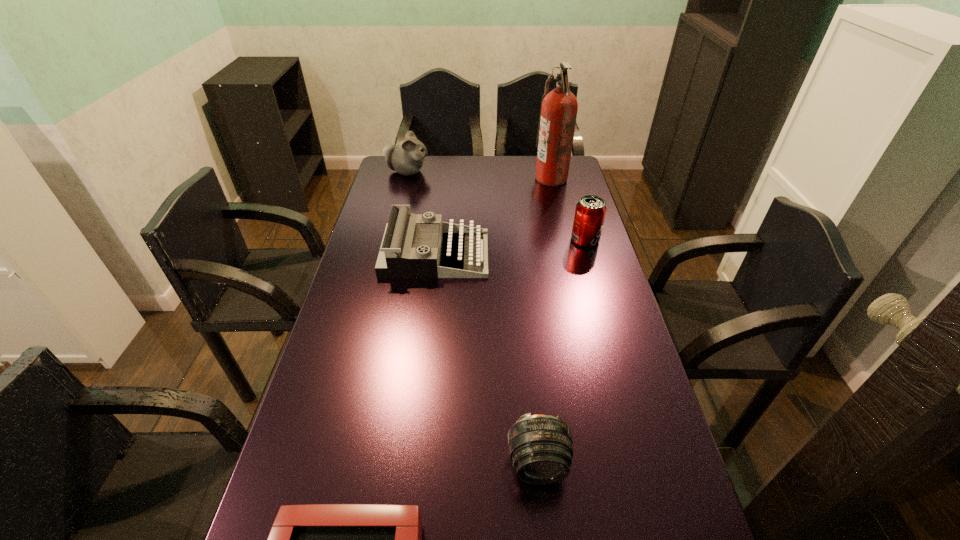
Choose which object is the nearest neighbor to the tallest object. Please provide its 2D coordinates. Your answer should be formatted as a tuple, i.e. [(x, y)], where the tuple contains the x and y coordinates of a point satisfying the conditions above.

[(590, 211)]

You are a GUI agent. You are given a task and a screenshot of the screen. Output one action in this format:
    pyautogui.click(x=<x>, y=<y>)
    Task: Click on the blank space that satisfies the following two spatial constraints: 1. on the back side of the soda can; 2. on the front of the fire extinguisher near the operation label
    The height and width of the screenshot is (540, 960).
    Given the screenshot: What is the action you would take?
    pyautogui.click(x=567, y=178)

The width and height of the screenshot is (960, 540). In order to click on free space that satisfies the following two spatial constraints: 1. on the front of the fire extinguisher near the operation label; 2. on the back side of the soda can in this screenshot , I will do `click(565, 240)`.

Locate an element on the screen. This screenshot has width=960, height=540. free space that satisfies the following two spatial constraints: 1. on the face of the soda can; 2. on the left side of the hamster is located at coordinates (391, 240).

Image resolution: width=960 pixels, height=540 pixels. Find the location of `vacant area that satisfies the following two spatial constraints: 1. on the front of the soda can near the operation label; 2. on the left side of the fire extinguisher`. vacant area that satisfies the following two spatial constraints: 1. on the front of the soda can near the operation label; 2. on the left side of the fire extinguisher is located at coordinates (565, 240).